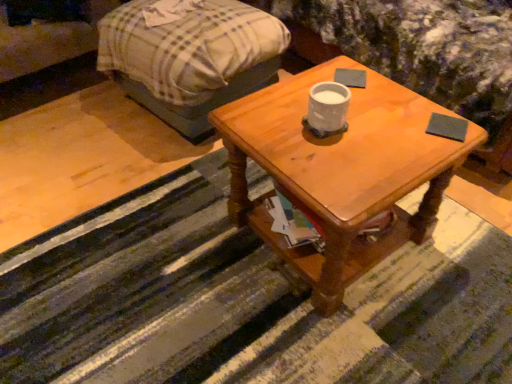
Find the location of a particular element. vacant space to the left of dark gray matte pad at upper right, the 1th pad when ordered from front to back is located at coordinates (391, 128).